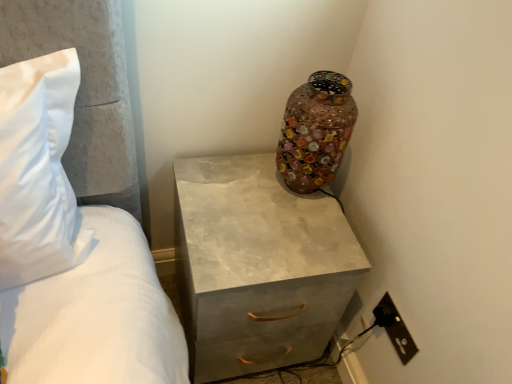
Question: Is matte concrete chest of drawers at center to the right of black plastic outlet at lower right from the viewer's perspective?

Choices:
 (A) yes
 (B) no

Answer: (B)

Question: Is matte concrete chest of drawers at center positioned in front of black plastic outlet at lower right?

Choices:
 (A) yes
 (B) no

Answer: (A)

Question: From the image's perspective, would you say matte concrete chest of drawers at center is positioned over black plastic outlet at lower right?

Choices:
 (A) yes
 (B) no

Answer: (A)

Question: Is matte concrete chest of drawers at center smaller than black plastic outlet at lower right?

Choices:
 (A) no
 (B) yes

Answer: (A)

Question: Does matte concrete chest of drawers at center have a greater height compared to black plastic outlet at lower right?

Choices:
 (A) yes
 (B) no

Answer: (A)

Question: From a real-world perspective, is black plastic outlet at lower right above or below multicolored mosaic vase at upper right?

Choices:
 (A) below
 (B) above

Answer: (A)

Question: Considering the positions of black plastic outlet at lower right and multicolored mosaic vase at upper right in the image, is black plastic outlet at lower right wider or thinner than multicolored mosaic vase at upper right?

Choices:
 (A) thin
 (B) wide

Answer: (A)

Question: From the image's perspective, relative to multicolored mosaic vase at upper right, is black plastic outlet at lower right above or below?

Choices:
 (A) above
 (B) below

Answer: (B)

Question: Is point (387, 299) closer or farther from the camera than point (350, 132)?

Choices:
 (A) closer
 (B) farther

Answer: (A)

Question: Relative to black plastic outlet at lower right, is multicolored mosaic vase at upper right in front or behind?

Choices:
 (A) behind
 (B) front

Answer: (B)

Question: Looking at their shapes, would you say multicolored mosaic vase at upper right is wider or thinner than black plastic outlet at lower right?

Choices:
 (A) wide
 (B) thin

Answer: (A)

Question: From a real-world perspective, is multicolored mosaic vase at upper right above or below black plastic outlet at lower right?

Choices:
 (A) above
 (B) below

Answer: (A)

Question: In terms of size, does multicolored mosaic vase at upper right appear bigger or smaller than black plastic outlet at lower right?

Choices:
 (A) big
 (B) small

Answer: (A)

Question: From a real-world perspective, is multicolored mosaic vase at upper right above or below matte concrete chest of drawers at center?

Choices:
 (A) below
 (B) above

Answer: (B)

Question: In the image, is multicolored mosaic vase at upper right positioned in front of or behind matte concrete chest of drawers at center?

Choices:
 (A) front
 (B) behind

Answer: (B)